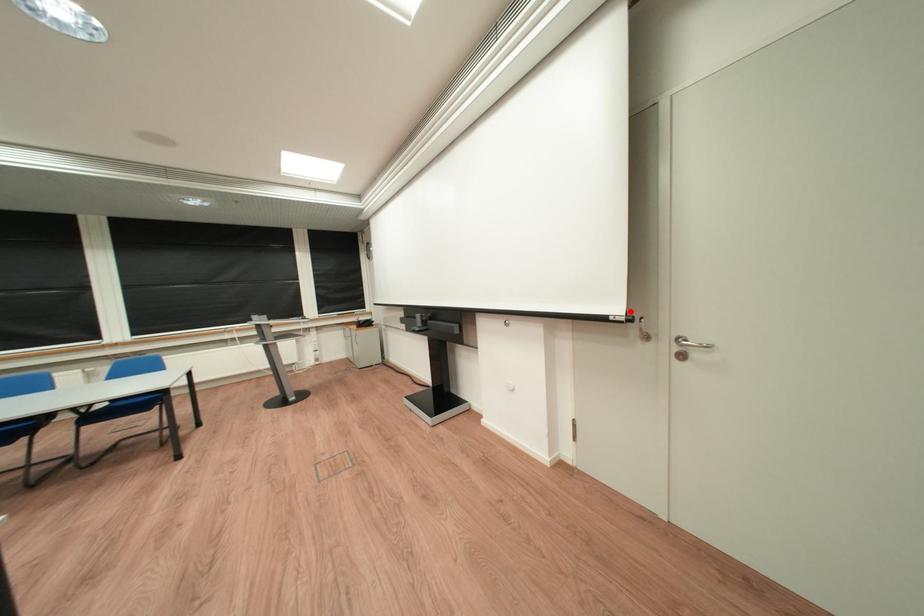
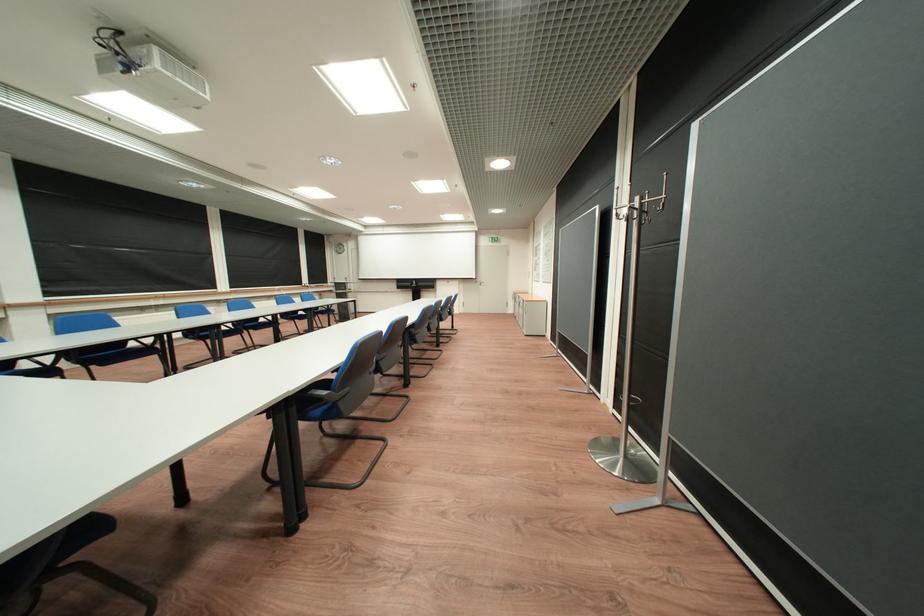
Question: I am providing you with two images of the same scene from different viewpoints. A red point is shown in image1. For the corresponding object point in image2, is it positioned nearer or farther from the camera?

Choices:
 (A) Nearer
 (B) Farther

Answer: (A)